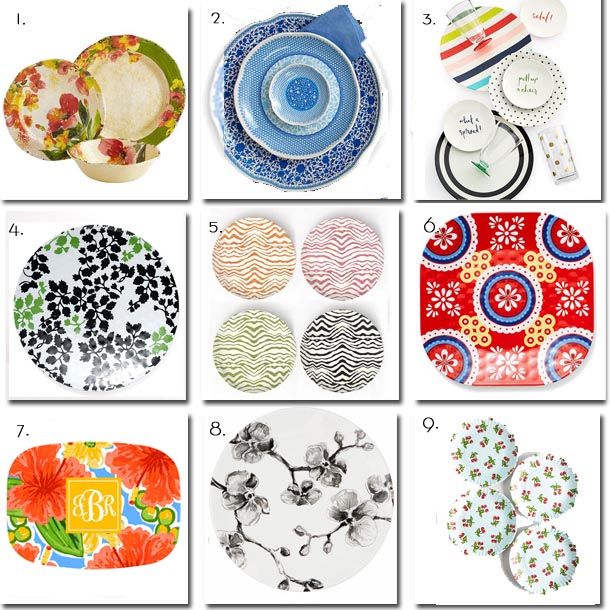
What are the coordinates of `small saucers` in the screenshot? It's located at (478, 116), (512, 94), (550, 29).